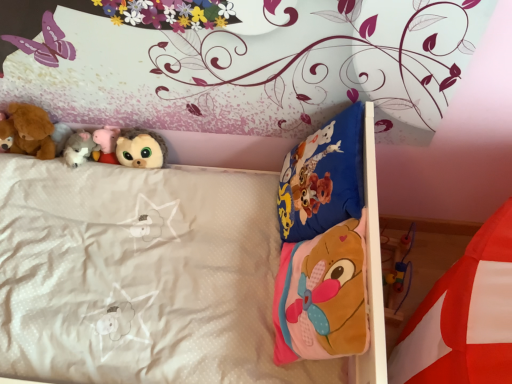
The image size is (512, 384). Describe the element at coordinates (464, 316) in the screenshot. I see `soft pink fabric mattress at lower right` at that location.

The height and width of the screenshot is (384, 512). Describe the element at coordinates (6, 134) in the screenshot. I see `brown plush bear at left, which is the first toy from left to right` at that location.

In order to face brown plush bear at left, which is the first toy from left to right, should I rotate leftwards or rightwards?

Rotate left and turn 31.995 degrees.

At what (x,y) coordinates should I click in order to perform the action: click on pink plush pig at upper left, the second toy in the right-to-left sequence. Please return your answer as a coordinate pair (x, y). This screenshot has width=512, height=384. Looking at the image, I should click on [x=106, y=144].

Where is `soft brown teddy bear at left, the 4th toy from the right`? This screenshot has height=384, width=512. soft brown teddy bear at left, the 4th toy from the right is located at coordinates (29, 131).

From the image's perspective, count 2nd toys upward from the white plush toy at upper left, the third toy when ordered from right to left, and point to it. Please provide its 2D coordinates.

[(6, 134)]

Does point (72, 162) come farther from viewer compared to point (3, 132)?

Yes, it is.

Would you say white plush toy at upper left, arranged as the third toy when viewed from the left, is inside or outside brown plush bear at left, which is the fifth toy in right-to-left order?

white plush toy at upper left, arranged as the third toy when viewed from the left, is outside brown plush bear at left, which is the fifth toy in right-to-left order.

From the image's perspective, does white plush toy at upper left, the third toy when ordered from right to left, appear lower than brown plush bear at left, which is the fifth toy in right-to-left order?

Yes, from the image's perspective, white plush toy at upper left, the third toy when ordered from right to left, is beneath brown plush bear at left, which is the fifth toy in right-to-left order.

Does soft pink fabric mattress at lower right have a greater height compared to brown plush bear at left, which is the first toy from left to right?

Yes, soft pink fabric mattress at lower right is taller than brown plush bear at left, which is the first toy from left to right.

From a real-world perspective, is soft pink fabric mattress at lower right on brown plush bear at left, which is the fifth toy in right-to-left order?

Yes.

Could you measure the distance between soft pink fabric mattress at lower right and brown plush bear at left, which is the fifth toy in right-to-left order?

soft pink fabric mattress at lower right and brown plush bear at left, which is the fifth toy in right-to-left order, are 4.28 feet apart from each other.

There is a soft pink fabric mattress at lower right. At what (x,y) coordinates should I click in order to perform the action: click on the 5th toy above it (from the image's perspective). Please return your answer as a coordinate pair (x, y). Looking at the image, I should click on (6, 134).

Based on the photo, could you tell me if brown plush bear at left, which is the fifth toy in right-to-left order, is facing white plush toy at upper left, arranged as the third toy when viewed from the left?

No, brown plush bear at left, which is the fifth toy in right-to-left order, is not aimed at white plush toy at upper left, arranged as the third toy when viewed from the left.

From the image's perspective, is brown plush bear at left, which is the first toy from left to right, above white plush toy at upper left, arranged as the third toy when viewed from the left?

Yes, from the image's perspective, brown plush bear at left, which is the first toy from left to right, is above white plush toy at upper left, arranged as the third toy when viewed from the left.

From a real-world perspective, is brown plush bear at left, which is the fifth toy in right-to-left order, above or below white plush toy at upper left, arranged as the third toy when viewed from the left?

In terms of real-world spatial position, brown plush bear at left, which is the fifth toy in right-to-left order, is above white plush toy at upper left, arranged as the third toy when viewed from the left.

How much distance is there between brown plush bear at left, which is the first toy from left to right, and white plush toy at upper left, the third toy when ordered from right to left?

They are 18.83 centimeters apart.

Which of these two, pink plush pig at upper left, which ranks as the 4th toy in left-to-right order, or fluffy brown plush at upper center, positioned as the first toy in right-to-left order, stands shorter?

Standing shorter between the two is pink plush pig at upper left, which ranks as the 4th toy in left-to-right order.

Which of these two, pink plush pig at upper left, which ranks as the 4th toy in left-to-right order, or fluffy brown plush at upper center, positioned as the first toy in right-to-left order, is wider?

fluffy brown plush at upper center, positioned as the first toy in right-to-left order, is wider.

In terms of size, does pink plush pig at upper left, the second toy in the right-to-left sequence, appear bigger or smaller than fluffy brown plush at upper center, positioned as the first toy in right-to-left order?

Clearly, pink plush pig at upper left, the second toy in the right-to-left sequence, is smaller in size than fluffy brown plush at upper center, positioned as the first toy in right-to-left order.

Considering the points (109, 153) and (163, 142), which point is in front, point (109, 153) or point (163, 142)?

Positioned in front is point (109, 153).

From a real-world perspective, is white plush toy at upper left, the third toy when ordered from right to left, positioned above or below fluffy brown plush at upper center, arranged as the 5th toy when viewed from the left?

From a real-world perspective, white plush toy at upper left, the third toy when ordered from right to left, is physically above fluffy brown plush at upper center, arranged as the 5th toy when viewed from the left.

How different are the orientations of white plush toy at upper left, arranged as the third toy when viewed from the left, and fluffy brown plush at upper center, arranged as the 5th toy when viewed from the left, in degrees?

The angle between the facing direction of white plush toy at upper left, arranged as the third toy when viewed from the left, and the facing direction of fluffy brown plush at upper center, arranged as the 5th toy when viewed from the left, is 0.00247 degrees.

Does point (85, 160) come in front of point (146, 137)?

That is True.

Based on the photo, who is smaller, white plush toy at upper left, arranged as the third toy when viewed from the left, or fluffy brown plush at upper center, positioned as the first toy in right-to-left order?

With smaller size is white plush toy at upper left, arranged as the third toy when viewed from the left.

Image resolution: width=512 pixels, height=384 pixels. What are the coordinates of `the 2nd toy below the white plush toy at upper left, arranged as the third toy when viewed from the left (from a real-world perspective)` in the screenshot? It's located at (106, 144).

From a real-world perspective, is pink plush pig at upper left, the second toy in the right-to-left sequence, physically located above or below white plush toy at upper left, the third toy when ordered from right to left?

Clearly, from a real-world perspective, pink plush pig at upper left, the second toy in the right-to-left sequence, is below white plush toy at upper left, the third toy when ordered from right to left.

Considering the relative positions of pink plush pig at upper left, the second toy in the right-to-left sequence, and white plush toy at upper left, arranged as the third toy when viewed from the left, in the image provided, is pink plush pig at upper left, the second toy in the right-to-left sequence, to the right of white plush toy at upper left, arranged as the third toy when viewed from the left, from the viewer's perspective?

Yes, pink plush pig at upper left, the second toy in the right-to-left sequence, is to the right of white plush toy at upper left, arranged as the third toy when viewed from the left.

Is pink plush pig at upper left, the second toy in the right-to-left sequence, taller or shorter than white plush toy at upper left, the third toy when ordered from right to left?

In the image, pink plush pig at upper left, the second toy in the right-to-left sequence, appears to be taller than white plush toy at upper left, the third toy when ordered from right to left.

Is soft pink fabric mattress at lower right facing towards pink plush pig at upper left, the second toy in the right-to-left sequence?

No, soft pink fabric mattress at lower right is not turned towards pink plush pig at upper left, the second toy in the right-to-left sequence.

Is soft pink fabric mattress at lower right surrounding pink plush pig at upper left, the second toy in the right-to-left sequence?

Definitely not — pink plush pig at upper left, the second toy in the right-to-left sequence, is not inside soft pink fabric mattress at lower right.

Can you confirm if soft pink fabric mattress at lower right is wider than pink plush pig at upper left, the second toy in the right-to-left sequence?

Yes, soft pink fabric mattress at lower right is wider than pink plush pig at upper left, the second toy in the right-to-left sequence.

From a real-world perspective, does soft pink fabric mattress at lower right sit lower than pink plush pig at upper left, the second toy in the right-to-left sequence?

No, from a real-world perspective, soft pink fabric mattress at lower right is not under pink plush pig at upper left, the second toy in the right-to-left sequence.

From the image's perspective, starting from the brown plush bear at left, which is the first toy from left to right, which toy is the 2nd one below? Please provide its 2D coordinates.

[(79, 148)]

Locate an element on the screen. The image size is (512, 384). mattress that is on the right side of brown plush bear at left, which is the first toy from left to right is located at coordinates (464, 316).

Looking at this image, considering their positions, is brown plush bear at left, which is the first toy from left to right, positioned closer to white plush toy at upper left, the third toy when ordered from right to left, than soft brown teddy bear at left, which appears as the 2th toy when viewed from the left?

soft brown teddy bear at left, which appears as the 2th toy when viewed from the left.

Based on their spatial positions, is soft brown teddy bear at left, the 4th toy from the right, or brown plush bear at left, which is the fifth toy in right-to-left order, closer to pink plush pig at upper left, which ranks as the 4th toy in left-to-right order?

soft brown teddy bear at left, the 4th toy from the right, lies closer to pink plush pig at upper left, which ranks as the 4th toy in left-to-right order, than the other object.

Considering their positions, is soft pink fabric mattress at lower right positioned further to white plush toy at upper left, arranged as the third toy when viewed from the left, than fluffy brown plush at upper center, arranged as the 5th toy when viewed from the left?

Among the two, soft pink fabric mattress at lower right is located further to white plush toy at upper left, arranged as the third toy when viewed from the left.

Considering their positions, is fluffy brown plush at upper center, positioned as the first toy in right-to-left order, positioned closer to white plush toy at upper left, arranged as the third toy when viewed from the left, than brown plush bear at left, which is the first toy from left to right?

fluffy brown plush at upper center, positioned as the first toy in right-to-left order.

From the picture: Considering their positions, is white plush toy at upper left, the third toy when ordered from right to left, positioned closer to soft brown teddy bear at left, which appears as the 2th toy when viewed from the left, than brown plush bear at left, which is the fifth toy in right-to-left order?

brown plush bear at left, which is the fifth toy in right-to-left order, is positioned closer to the anchor soft brown teddy bear at left, which appears as the 2th toy when viewed from the left.

Based on the photo, from the image, which object appears to be farther from pink plush pig at upper left, which ranks as the 4th toy in left-to-right order, soft pink fabric mattress at lower right or soft brown teddy bear at left, the 4th toy from the right?

soft pink fabric mattress at lower right is positioned further to the anchor pink plush pig at upper left, which ranks as the 4th toy in left-to-right order.

In the scene shown: Which object lies nearer to the anchor point white plush toy at upper left, arranged as the third toy when viewed from the left, fluffy brown plush at upper center, arranged as the 5th toy when viewed from the left, or soft brown teddy bear at left, which appears as the 2th toy when viewed from the left?

Based on the image, soft brown teddy bear at left, which appears as the 2th toy when viewed from the left, appears to be nearer to white plush toy at upper left, arranged as the third toy when viewed from the left.

Looking at the image, which one is located closer to soft brown teddy bear at left, which appears as the 2th toy when viewed from the left, brown plush bear at left, which is the fifth toy in right-to-left order, or soft pink fabric mattress at lower right?

brown plush bear at left, which is the fifth toy in right-to-left order, is closer to soft brown teddy bear at left, which appears as the 2th toy when viewed from the left.

You are a GUI agent. You are given a task and a screenshot of the screen. Output one action in this format:
    pyautogui.click(x=<x>, y=<y>)
    Task: Click on the toy between brown plush bear at left, which is the first toy from left to right, and white plush toy at upper left, arranged as the third toy when viewed from the left
    The width and height of the screenshot is (512, 384).
    Given the screenshot: What is the action you would take?
    pyautogui.click(x=29, y=131)

You are a GUI agent. You are given a task and a screenshot of the screen. Output one action in this format:
    pyautogui.click(x=<x>, y=<y>)
    Task: Click on the toy between soft pink fabric mattress at lower right and fluffy brown plush at upper center, arranged as the 5th toy when viewed from the left, along the z-axis
    The height and width of the screenshot is (384, 512).
    Given the screenshot: What is the action you would take?
    pyautogui.click(x=29, y=131)

The image size is (512, 384). Find the location of `toy situated between white plush toy at upper left, arranged as the third toy when viewed from the left, and fluffy brown plush at upper center, positioned as the first toy in right-to-left order, from left to right`. toy situated between white plush toy at upper left, arranged as the third toy when viewed from the left, and fluffy brown plush at upper center, positioned as the first toy in right-to-left order, from left to right is located at coordinates (106, 144).

Locate an element on the screen. This screenshot has width=512, height=384. toy situated between soft brown teddy bear at left, which appears as the 2th toy when viewed from the left, and pink plush pig at upper left, which ranks as the 4th toy in left-to-right order, from left to right is located at coordinates point(79,148).